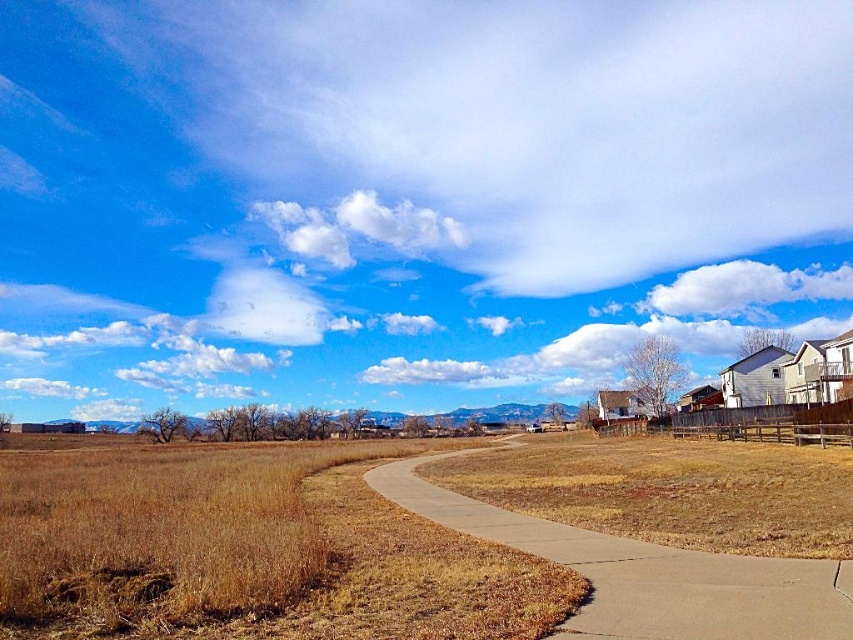
Is smooth concrete path at center bigger than white fluffy cloud at upper right?

No, smooth concrete path at center is not bigger than white fluffy cloud at upper right.

Does point (839, 592) come in front of point (691, 301)?

That is True.

Where is `smooth concrete path at center`? smooth concrete path at center is located at coordinates (643, 572).

Does smooth concrete path at center appear on the right side of white fluffy cloud at upper center?

Yes, smooth concrete path at center is to the right of white fluffy cloud at upper center.

Which is in front, point (517, 531) or point (421, 236)?

Point (517, 531)

Between point (671, 604) and point (337, 205), which one is positioned behind?

Point (337, 205)

Locate an element on the screen. The image size is (853, 640). smooth concrete path at center is located at coordinates (643, 572).

Who is more forward, (320, 214) or (741, 280)?

Point (320, 214)

Can you confirm if white fluffy cloud at upper center is bigger than white fluffy cloud at upper right?

No, white fluffy cloud at upper center is not bigger than white fluffy cloud at upper right.

Is point (428, 225) positioned in front of point (840, 275)?

Yes, point (428, 225) is in front of point (840, 275).

At what (x,y) coordinates should I click in order to perform the action: click on white fluffy cloud at upper center. Please return your answer as a coordinate pair (x, y). This screenshot has height=640, width=853. Looking at the image, I should click on (358, 227).